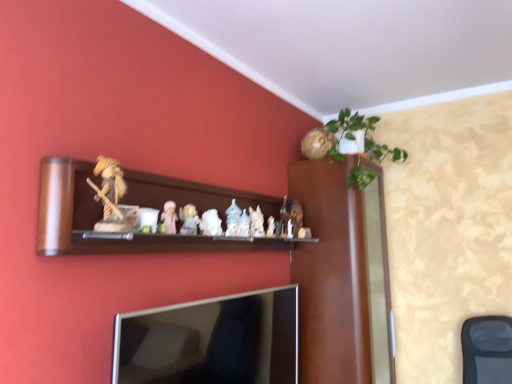
In order to click on white porcelain figurines at center, acting as the 3th toy starting from the front in this screenshot , I will do `click(189, 219)`.

Locate an element on the screen. The image size is (512, 384). white porcelain figurine at center, positioned as the 5th toy in left-to-right order is located at coordinates (256, 222).

Where is `white porcelain figurines at center, the third toy positioned from the left`? white porcelain figurines at center, the third toy positioned from the left is located at coordinates (189, 219).

Considering the sizes of objects white porcelain figurines at center, the third toy positioned from the left, and white porcelain figurine at center, positioned as the second toy in back-to-front order, in the image provided, who is smaller, white porcelain figurines at center, the third toy positioned from the left, or white porcelain figurine at center, positioned as the second toy in back-to-front order,?

white porcelain figurines at center, the third toy positioned from the left.

Can you confirm if white porcelain figurines at center, the third toy positioned from the left, is wider than white porcelain figurine at center, which is counted as the second toy, starting from the right?

Indeed, white porcelain figurines at center, the third toy positioned from the left, has a greater width compared to white porcelain figurine at center, which is counted as the second toy, starting from the right.

Is white porcelain figurines at center, placed as the fourth toy when sorted from back to front, facing towards white porcelain figurine at center, positioned as the second toy in back-to-front order?

No, white porcelain figurines at center, placed as the fourth toy when sorted from back to front, does not turn towards white porcelain figurine at center, positioned as the second toy in back-to-front order.

The image size is (512, 384). What are the coordinates of `toy that is the 2nd one when counting leftward from the white porcelain figurine at center, positioned as the second toy in back-to-front order` in the screenshot? It's located at (189, 219).

Identify the location of the 5th toy to the left when counting from the matte porcelain figurine at center, which is counted as the 6th toy, starting from the front. (112, 196).

Between point (284, 221) and point (116, 219), which one is positioned in front?

The point (116, 219) is in front.

Does matte porcelain figurine at center, positioned as the 1th toy in right-to-left order, lie behind fuzzy brown figure at upper center, the 6th toy in the back-to-front sequence?

Yes, matte porcelain figurine at center, positioned as the 1th toy in right-to-left order, is further from the viewer.

Looking at their sizes, would you say matte porcelain figurine at center, positioned as the 6th toy in left-to-right order, is wider or thinner than fuzzy brown figure at upper center, the first toy when ordered from front to back?

Considering their sizes, matte porcelain figurine at center, positioned as the 6th toy in left-to-right order, looks slimmer than fuzzy brown figure at upper center, the first toy when ordered from front to back.

Looking at this image, how far apart are matte porcelain figurine at center, positioned as the 1th toy in right-to-left order, and white porcelain figurine at center, the fifth toy in the front-to-back sequence?

matte porcelain figurine at center, positioned as the 1th toy in right-to-left order, is 13.55 inches away from white porcelain figurine at center, the fifth toy in the front-to-back sequence.

Could you tell me if matte porcelain figurine at center, positioned as the 1th toy in right-to-left order, is turned towards white porcelain figurine at center, positioned as the second toy in back-to-front order?

No, matte porcelain figurine at center, positioned as the 1th toy in right-to-left order, does not turn towards white porcelain figurine at center, positioned as the second toy in back-to-front order.

Can you confirm if matte porcelain figurine at center, which is counted as the 6th toy, starting from the front, is shorter than white porcelain figurine at center, which is counted as the second toy, starting from the right?

In fact, matte porcelain figurine at center, which is counted as the 6th toy, starting from the front, may be taller than white porcelain figurine at center, which is counted as the second toy, starting from the right.

Based on the photo, between white porcelain figurine at center, the 3th toy when ordered from right to left, and fuzzy brown figure at upper center, placed as the 1th toy when sorted from left to right, which one has larger size?

fuzzy brown figure at upper center, placed as the 1th toy when sorted from left to right, is bigger.

From a real-world perspective, is white porcelain figurine at center, the fourth toy positioned from the left, located higher than fuzzy brown figure at upper center, the 6th toy in the back-to-front sequence?

No, from a real-world perspective, white porcelain figurine at center, the fourth toy positioned from the left, is not on top of fuzzy brown figure at upper center, the 6th toy in the back-to-front sequence.

Where is `the 3rd toy to the right when counting from the fuzzy brown figure at upper center, the first toy when ordered from front to back`? the 3rd toy to the right when counting from the fuzzy brown figure at upper center, the first toy when ordered from front to back is located at coordinates (210, 223).

From the image's perspective, is white porcelain figurine at center, positioned as the second toy in back-to-front order, over silver metallic tv at lower center?

Indeed, from the image's perspective, white porcelain figurine at center, positioned as the second toy in back-to-front order, is shown above silver metallic tv at lower center.

In terms of height, does white porcelain figurine at center, positioned as the second toy in back-to-front order, look taller or shorter compared to silver metallic tv at lower center?

Considering their sizes, white porcelain figurine at center, positioned as the second toy in back-to-front order, has less height than silver metallic tv at lower center.

Looking at this image, is white porcelain figurine at center, positioned as the second toy in back-to-front order, inside or outside of silver metallic tv at lower center?

The correct answer is: outside.

From the image's perspective, would you say white porcelain figurine at center, positioned as the 5th toy in left-to-right order, is shown under black mesh swivel chair at lower right?

No, from the image's perspective, white porcelain figurine at center, positioned as the 5th toy in left-to-right order, is not below black mesh swivel chair at lower right.

Is white porcelain figurine at center, the fifth toy in the front-to-back sequence, not within black mesh swivel chair at lower right?

white porcelain figurine at center, the fifth toy in the front-to-back sequence, lies outside black mesh swivel chair at lower right's area.

Is the position of white porcelain figurine at center, which is counted as the second toy, starting from the right, more distant than that of black mesh swivel chair at lower right?

No, white porcelain figurine at center, which is counted as the second toy, starting from the right, is in front of black mesh swivel chair at lower right.

Which is closer to the camera, (257, 236) or (471, 377)?

Point (257, 236) is positioned closer to the camera compared to point (471, 377).

Is porcelain figurine at center, arranged as the fifth toy when viewed from the right, placed right next to wooden shelf at center?

porcelain figurine at center, arranged as the fifth toy when viewed from the right, is not next to wooden shelf at center, and they're not touching.

Which object is further away from the camera, porcelain figurine at center, arranged as the fifth toy when viewed from the right, or wooden shelf at center?

porcelain figurine at center, arranged as the fifth toy when viewed from the right.

Considering the relative sizes of porcelain figurine at center, the fifth toy from the back, and wooden shelf at center in the image provided, is porcelain figurine at center, the fifth toy from the back, smaller than wooden shelf at center?

Yes, porcelain figurine at center, the fifth toy from the back, is smaller than wooden shelf at center.

From the image's perspective, which toy is the 2nd one below the white porcelain figurines at center, the third toy positioned from the left? Please provide its 2D coordinates.

[(256, 222)]

At what (x,y) coordinates should I click in order to perform the action: click on the 5th toy to the left of the matte porcelain figurine at center, positioned as the 6th toy in left-to-right order, counting from the anchor's position. Please return your answer as a coordinate pair (x, y). This screenshot has height=384, width=512. Looking at the image, I should click on (112, 196).

Looking at the image, which one is located further to white porcelain figurine at center, the 3th toy when ordered from right to left, white porcelain figurines at center, the fourth toy from the right, or porcelain figurine at center, arranged as the fifth toy when viewed from the right?

The object further to white porcelain figurine at center, the 3th toy when ordered from right to left, is porcelain figurine at center, arranged as the fifth toy when viewed from the right.

Looking at this image, which object lies nearer to the anchor point fuzzy brown figure at upper center, the 6th toy in the back-to-front sequence, green leafy plant at upper right or wooden shelf at center?

Based on the image, wooden shelf at center appears to be nearer to fuzzy brown figure at upper center, the 6th toy in the back-to-front sequence.

When comparing their distances from white porcelain figurine at center, positioned as the 5th toy in left-to-right order, does black mesh swivel chair at lower right or green leafy plant at upper right seem closer?

Among the two, green leafy plant at upper right is located nearer to white porcelain figurine at center, positioned as the 5th toy in left-to-right order.

Estimate the real-world distances between objects in this image. Which object is closer to porcelain figurine at center, arranged as the fifth toy when viewed from the right, matte porcelain figurine at center, acting as the 1th toy starting from the back, or green leafy plant at upper right?

The object closer to porcelain figurine at center, arranged as the fifth toy when viewed from the right, is matte porcelain figurine at center, acting as the 1th toy starting from the back.

Considering their positions, is matte porcelain figurine at center, acting as the 1th toy starting from the back, positioned further to white porcelain figurines at center, the third toy positioned from the left, than green leafy plant at upper right?

Based on the image, green leafy plant at upper right appears to be further to white porcelain figurines at center, the third toy positioned from the left.

From the image, which object appears to be farther from silver metallic tv at lower center, green leafy plant at upper right or fuzzy brown figure at upper center, placed as the 1th toy when sorted from left to right?

Among the two, green leafy plant at upper right is located further to silver metallic tv at lower center.

Which object lies nearer to the anchor point black mesh swivel chair at lower right, fuzzy brown figure at upper center, placed as the 1th toy when sorted from left to right, or porcelain figurine at center, the fifth toy from the back?

porcelain figurine at center, the fifth toy from the back, is closer to black mesh swivel chair at lower right.

Looking at this image, estimate the real-world distances between objects in this image. Which object is further from fuzzy brown figure at upper center, the first toy when ordered from front to back, green leafy plant at upper right or silver metallic tv at lower center?

green leafy plant at upper right is positioned further to the anchor fuzzy brown figure at upper center, the first toy when ordered from front to back.

This screenshot has width=512, height=384. In order to click on shelf between white porcelain figurines at center, the third toy positioned from the left, and black mesh swivel chair at lower right, in the horizontal direction in this screenshot , I will do `click(101, 218)`.

The width and height of the screenshot is (512, 384). I want to click on plant between fuzzy brown figure at upper center, which is the sixth toy in right-to-left order, and matte porcelain figurine at center, which is counted as the 6th toy, starting from the front, in the front-back direction, so click(x=364, y=137).

Where is `toy between porcelain figurine at center, the second toy when ordered from front to back, and white porcelain figurine at center, the third toy viewed from the back, from front to back`? toy between porcelain figurine at center, the second toy when ordered from front to back, and white porcelain figurine at center, the third toy viewed from the back, from front to back is located at coordinates (189, 219).

What are the coordinates of `plant between white porcelain figurines at center, placed as the fourth toy when sorted from back to front, and black mesh swivel chair at lower right from left to right` in the screenshot? It's located at (364, 137).